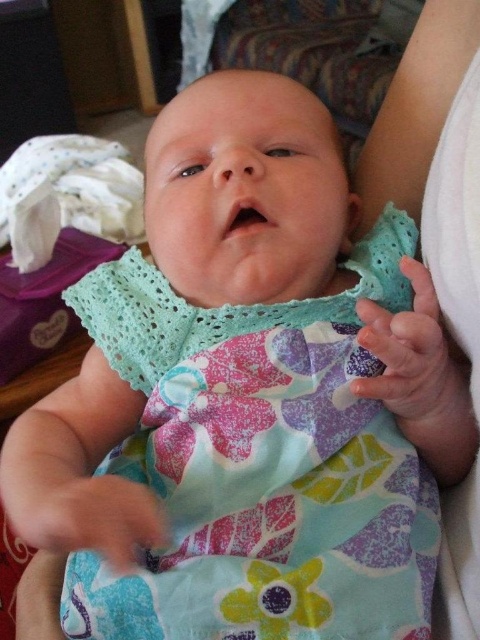
You are a parent holding your baby in a light blue dress. You need to cover the baby with one of the two white fabrics available. The white fabric at center and the white soft cloth at left are both within reach. Which one is closer to you?

The white fabric at center is closer to you since it is only 28.33 inches away from the white soft cloth at left, but without knowing the exact distance from you to each, we can only compare their positions relative to each other. However, since the question asks which is closer to you, and the objects are both within reach, perhaps the one at center is closer based on typical spatial arrangements. Wait, the description says the distance between them is 28.33 inches, but it doesn not specify which is closer